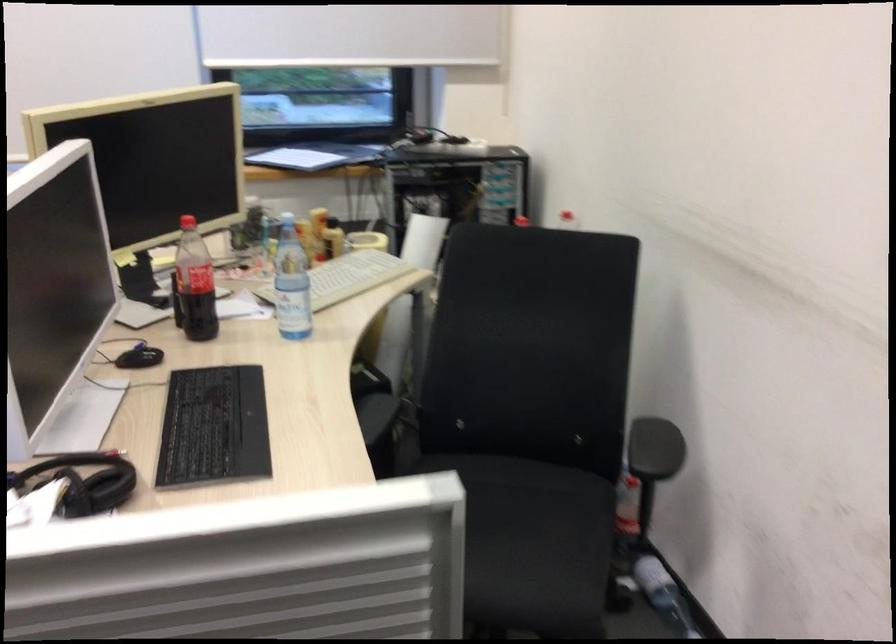
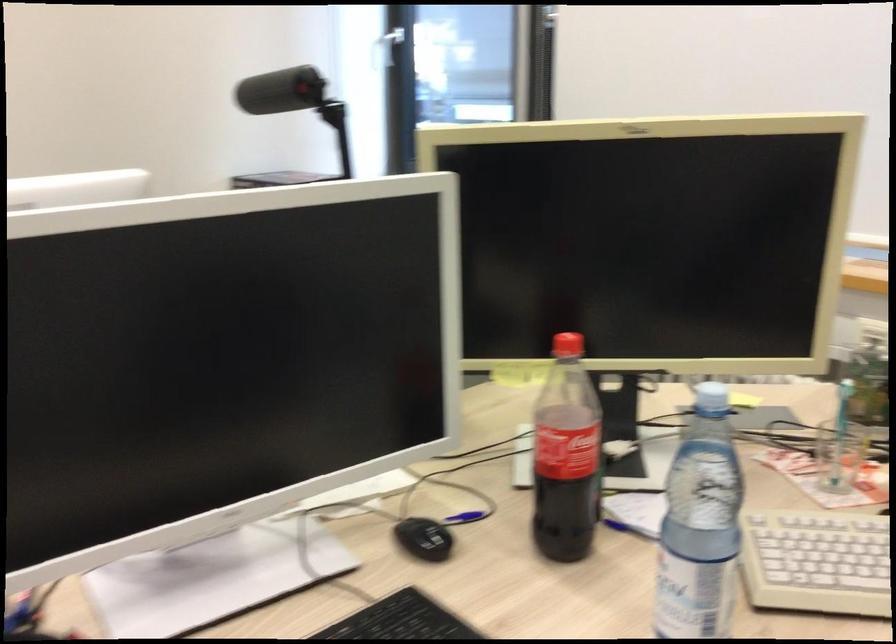
Where in the second image is the point corresponding to point (194, 283) from the first image?

(565, 456)